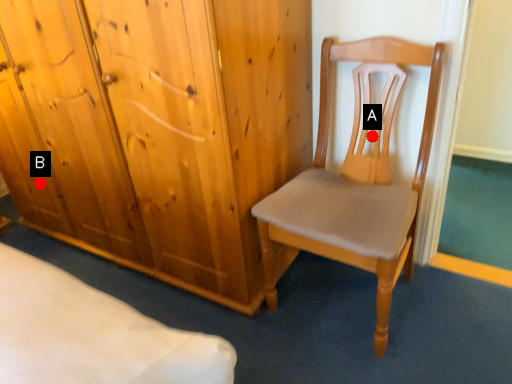
Question: Two points are circled on the image, labeled by A and B beside each circle. Which point is closer to the camera taking this photo?

Choices:
 (A) A is closer
 (B) B is closer

Answer: (A)